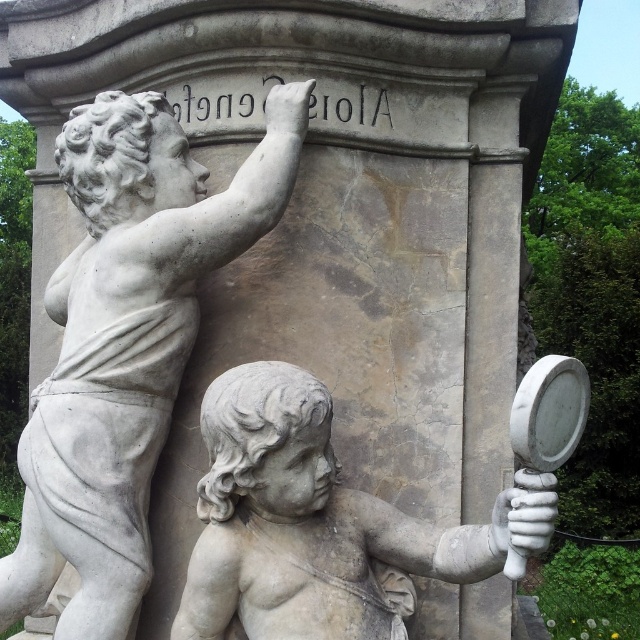
Question: Is white marble cherub at upper left to the right of white marble cherub at lower center from the viewer's perspective?

Choices:
 (A) yes
 (B) no

Answer: (B)

Question: Among these objects, which one is nearest to the camera?

Choices:
 (A) white marble cherub at upper left
 (B) white marble cherub at lower center

Answer: (B)

Question: Does white marble cherub at upper left appear on the left side of white marble cherub at lower center?

Choices:
 (A) yes
 (B) no

Answer: (A)

Question: Does white marble cherub at upper left appear over white marble cherub at lower center?

Choices:
 (A) no
 (B) yes

Answer: (B)

Question: Which of the following is the closest to the observer?

Choices:
 (A) white marble cherub at upper left
 (B) white marble cherub at lower center

Answer: (B)